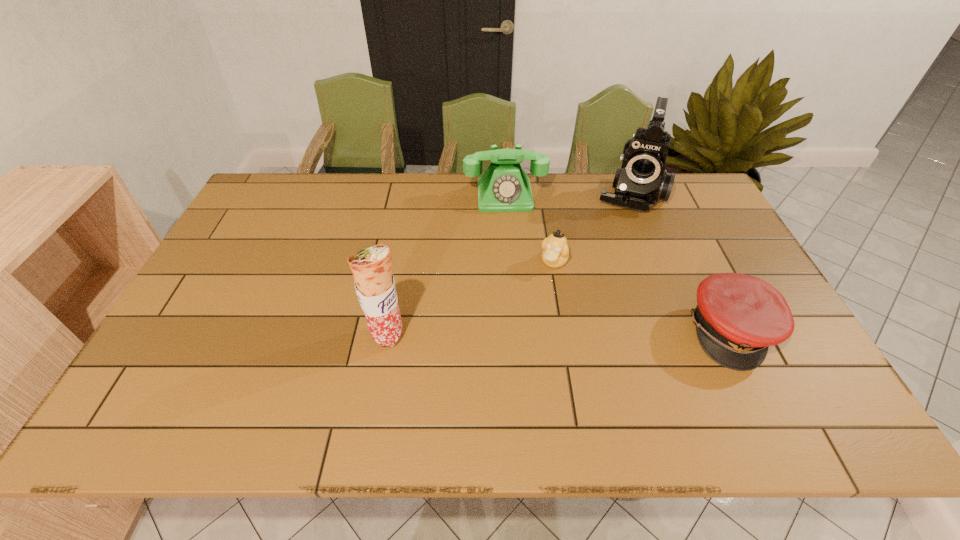
Locate an element on the screen. The width and height of the screenshot is (960, 540). free space located on the face of the duckling is located at coordinates (542, 285).

This screenshot has width=960, height=540. Identify the location of vacant space situated 0.190m on the face of the duckling. (522, 320).

You are a GUI agent. You are given a task and a screenshot of the screen. Output one action in this format:
    pyautogui.click(x=<x>, y=<y>)
    Task: Click on the vacant position located 0.070m on the lens mount of the camcorder
    
    Given the screenshot: What is the action you would take?
    pyautogui.click(x=622, y=227)

Identify the location of vacant area situated on the lens mount of the camcorder. click(x=619, y=238).

Identify the location of free space located 0.290m on the lens mount of the camcorder. (611, 274).

This screenshot has height=540, width=960. What are the coordinates of `telephone that is at the far edge` in the screenshot? It's located at (504, 187).

At what (x,y) coordinates should I click in order to perform the action: click on camcorder located at the far edge. Please return your answer as a coordinate pair (x, y). Looking at the image, I should click on (642, 180).

Locate an element on the screen. This screenshot has width=960, height=540. object at the near edge is located at coordinates (738, 316).

What are the coordinates of `cap that is at the right edge` in the screenshot? It's located at pos(738,316).

Locate an element on the screen. This screenshot has width=960, height=540. camcorder situated at the right edge is located at coordinates (642, 180).